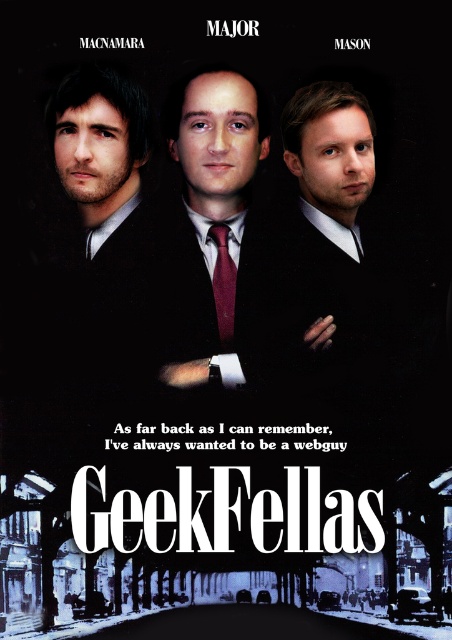
In the scene shown: You are a costume designer preparing for a play adaptation of the film. You need to ensure that the matte black suit at center and the maroon satin tie at center are proportionate to each other. Based on the image, which object should you adjust in size to achieve this?

The matte black suit at center is bigger than the maroon satin tie at center. To make them proportionate, you should reduce the size of the matte black suit at center or increase the size of the maroon satin tie at center.

You are a costume designer reviewing the GeekFellas movie poster. You need to determine the placement of the matte black suit at center and maroon satin tie at center. According to the poster, which item is positioned higher?

The matte black suit at center is positioned higher than the maroon satin tie at center according to the poster.

You are a costume designer preparing for a play adaptation of the movie. You need to ensure that the matte black suit at center and the maroon satin tie at center are proportionate. Based on the image, which object should you adjust in size to achieve this?

The matte black suit at center is much taller than the maroon satin tie at center. To make them proportionate, you should increase the size of the maroon satin tie at center to match the height of the matte black suit at center.